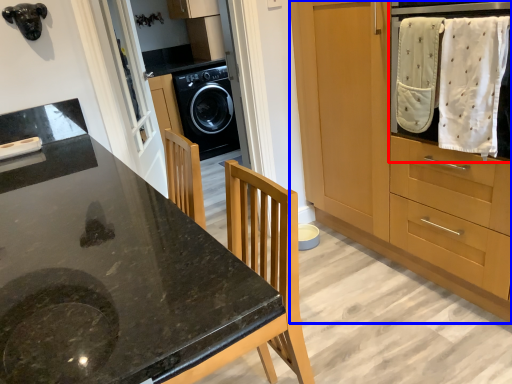
Question: Which point is further to the camera, home appliance (highlighted by a red box) or cabinetry (highlighted by a blue box)?

Choices:
 (A) home appliance
 (B) cabinetry

Answer: (A)